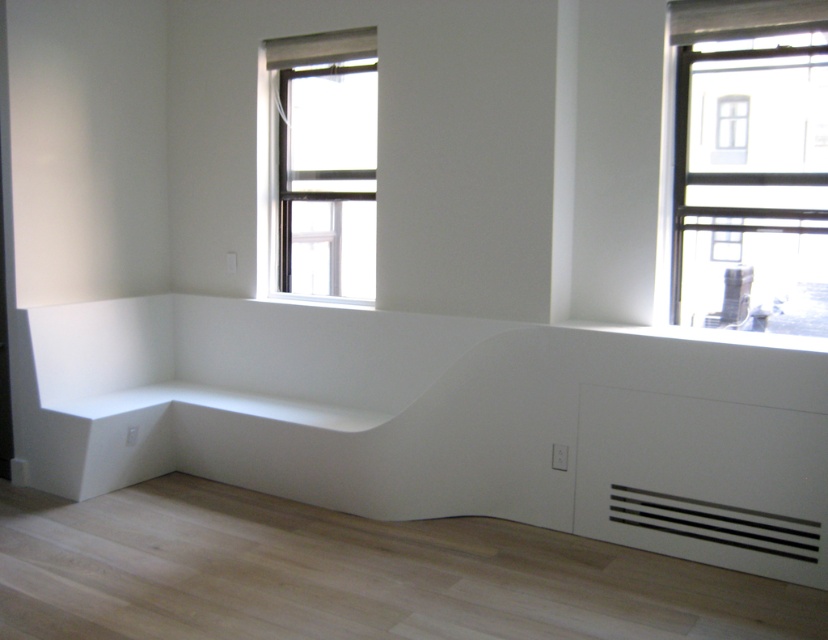
You are planning to place a large sofa in this living room. The sofa is 2 meters in length. You see the white smooth bench at lower left and the clear glass window at upper center. Which object should you avoid placing the sofa near to ensure there is enough space?

The white smooth bench at lower left has a larger size compared to the clear glass window at upper center. Therefore, placing the sofa near the white smooth bench at lower left may require more space, so it is better to avoid placing the sofa near the white smooth bench at lower left to ensure enough space.

You are standing in the minimalist living room and see two points marked on the wall. The first point is at coordinates point (244, 332), and the second point is at coordinates point (802, 138). If you are facing the wall with both points, which point is closer to you?

Point (802, 138) is closer to you because point (244, 332) is behind it.